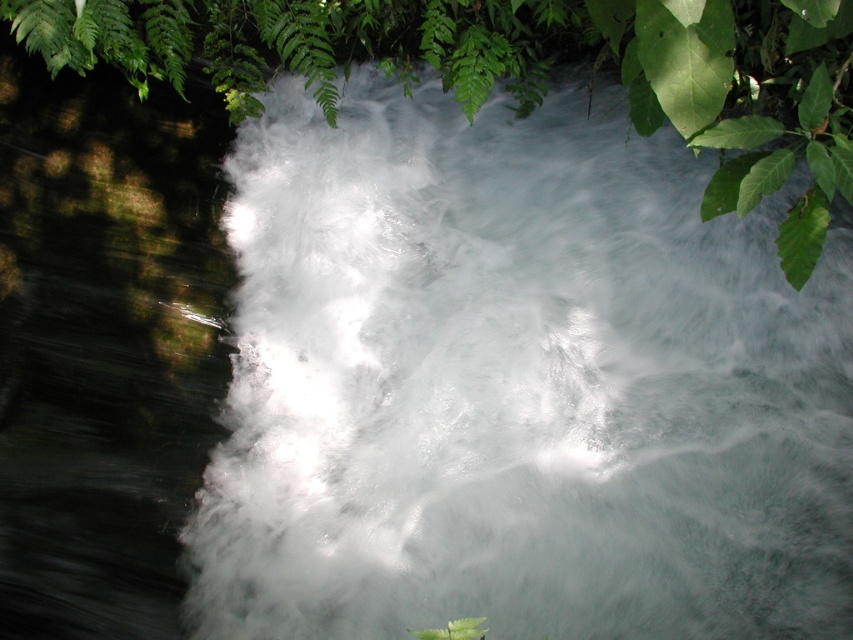
Does green leafy tree at upper center appear on the left side of green matte leaf at upper right?

Correct, you'll find green leafy tree at upper center to the left of green matte leaf at upper right.

Between green leafy tree at upper center and green matte leaf at upper right, which one appears on the right side from the viewer's perspective?

green matte leaf at upper right is more to the right.

Identify the location of green leafy tree at upper center. This screenshot has height=640, width=853. (518, 68).